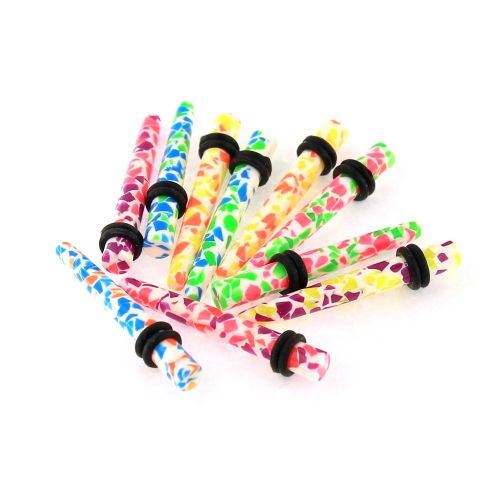
What are the coordinates of `pink and purple plug` in the screenshot? It's located at (216, 319), (133, 187).